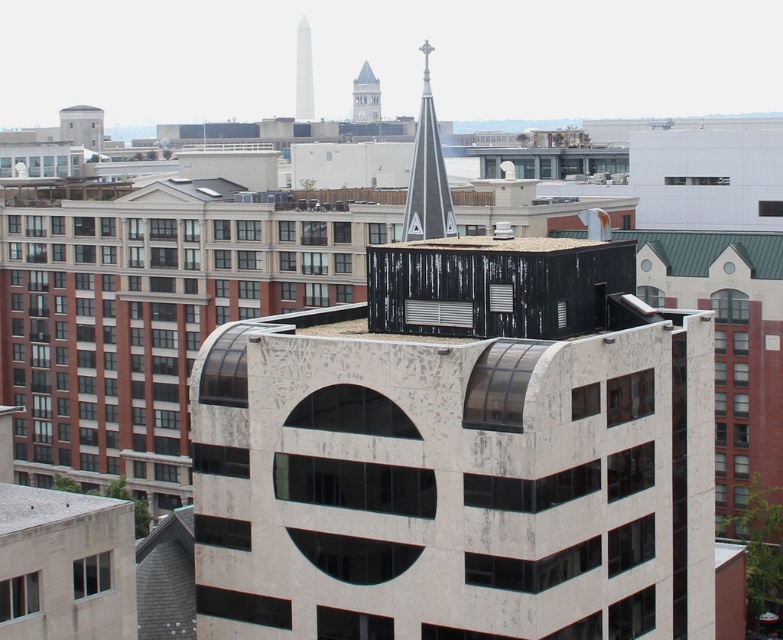
Can you confirm if green corrugated metal roof at upper right is bigger than white marble tower at upper center?

No, green corrugated metal roof at upper right is not bigger than white marble tower at upper center.

Who is more distant from viewer, (720, 250) or (298, 99)?

Positioned behind is point (298, 99).

This screenshot has height=640, width=783. What are the coordinates of `green corrugated metal roof at upper right` in the screenshot? It's located at (709, 250).

Can you confirm if white marble tower at upper center is smaller than smooth gray steeple at upper center?

No.

From the picture: Can you confirm if white marble tower at upper center is taller than smooth gray steeple at upper center?

Yes, white marble tower at upper center is taller than smooth gray steeple at upper center.

The height and width of the screenshot is (640, 783). What are the coordinates of `white marble tower at upper center` in the screenshot? It's located at (302, 72).

You are a GUI agent. You are given a task and a screenshot of the screen. Output one action in this format:
    pyautogui.click(x=<x>, y=<y>)
    Task: Click on the white marble tower at upper center
    The height and width of the screenshot is (640, 783).
    Given the screenshot: What is the action you would take?
    pyautogui.click(x=302, y=72)

Can you confirm if gray shingles spire at upper center is positioned above smooth gray steeple at upper center?

No, gray shingles spire at upper center is not above smooth gray steeple at upper center.

Does gray shingles spire at upper center have a larger size compared to smooth gray steeple at upper center?

Actually, gray shingles spire at upper center might be smaller than smooth gray steeple at upper center.

At what (x,y) coordinates should I click in order to perform the action: click on gray shingles spire at upper center. Please return your answer as a coordinate pair (x, y). The image size is (783, 640). Looking at the image, I should click on (428, 173).